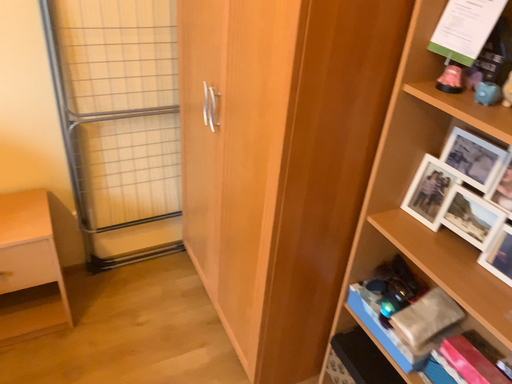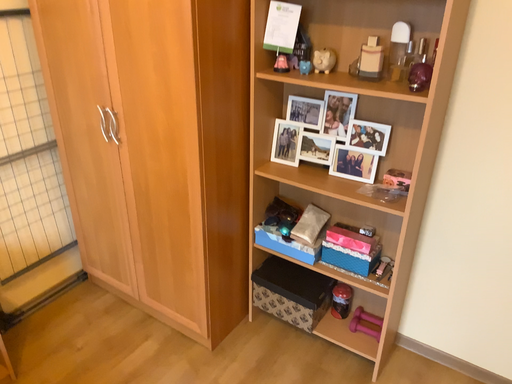
Question: Which way did the camera rotate in the video?

Choices:
 (A) rotated upward
 (B) rotated downward

Answer: (A)